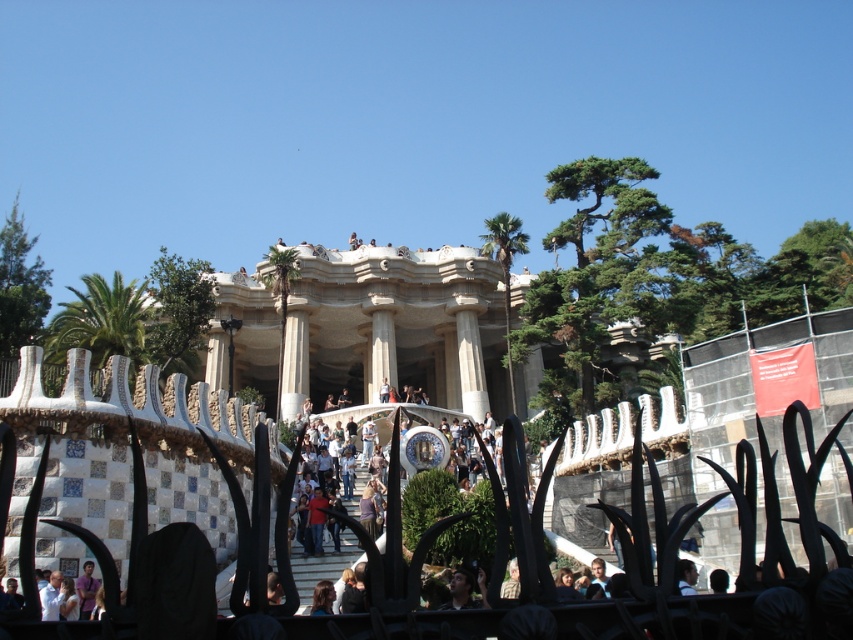
Question: Is the position of white stone palace at center more distant than that of dark brown hair at center?

Choices:
 (A) yes
 (B) no

Answer: (A)

Question: Estimate the real-world distances between objects in this image. Which object is farther from the dark brown leather jacket at lower center?

Choices:
 (A) white stone palace at center
 (B) dark brown hair at center

Answer: (A)

Question: From the image, what is the correct spatial relationship of white stone palace at center in relation to dark brown hair at center?

Choices:
 (A) below
 (B) above

Answer: (B)

Question: Based on their relative distances, which object is nearer to the dark brown leather jacket at lower center?

Choices:
 (A) dark brown hair at center
 (B) white stone palace at center

Answer: (A)

Question: Which point is farther to the camera?

Choices:
 (A) (462, 570)
 (B) (683, 573)

Answer: (A)

Question: Is white stone palace at center below dark brown hair at center?

Choices:
 (A) no
 (B) yes

Answer: (A)